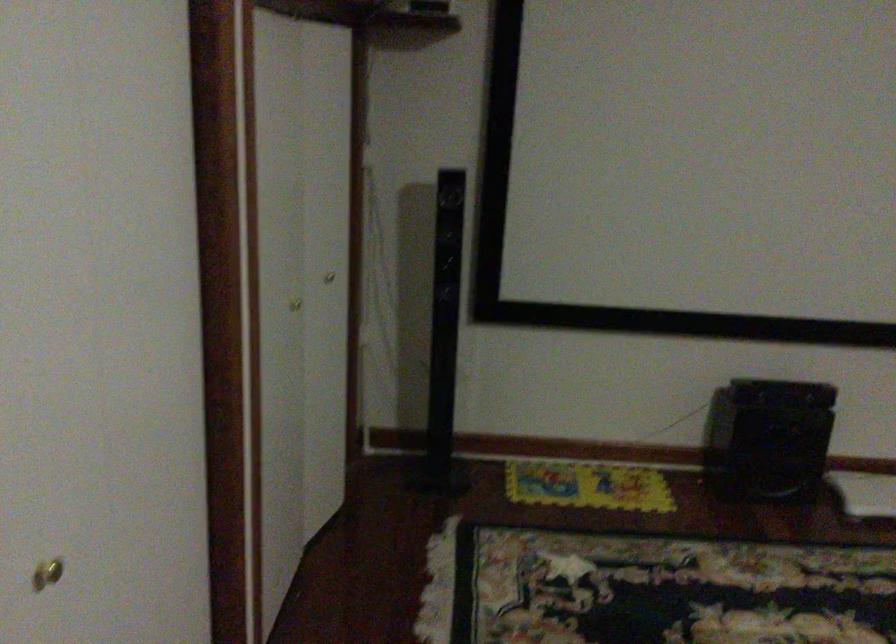
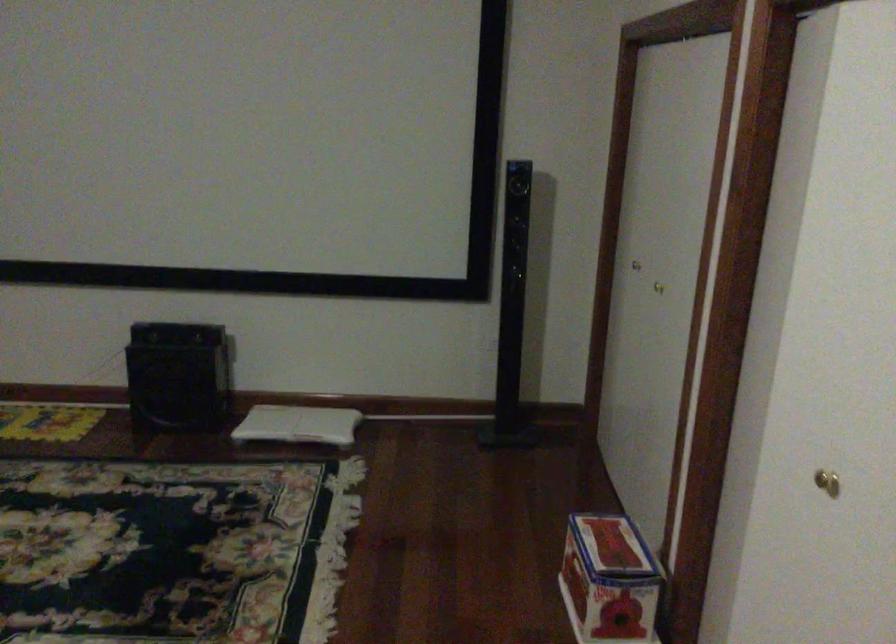
Question: What movement of the cameraman would produce the second image?

Choices:
 (A) Left
 (B) Right
 (C) Forward
 (D) Backward

Answer: (B)